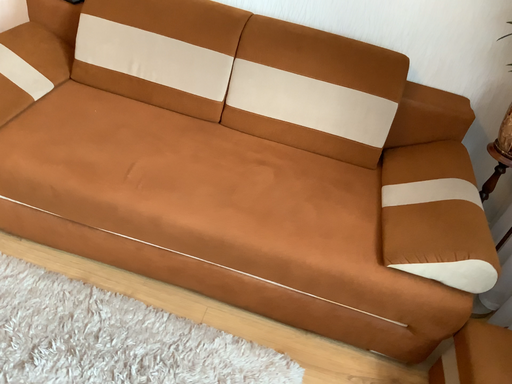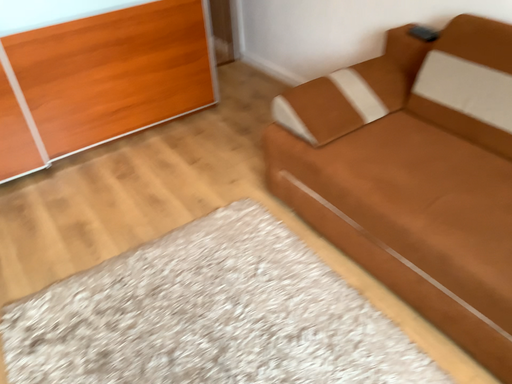
Question: Which way did the camera rotate in the video?

Choices:
 (A) rotated right
 (B) rotated left

Answer: (B)